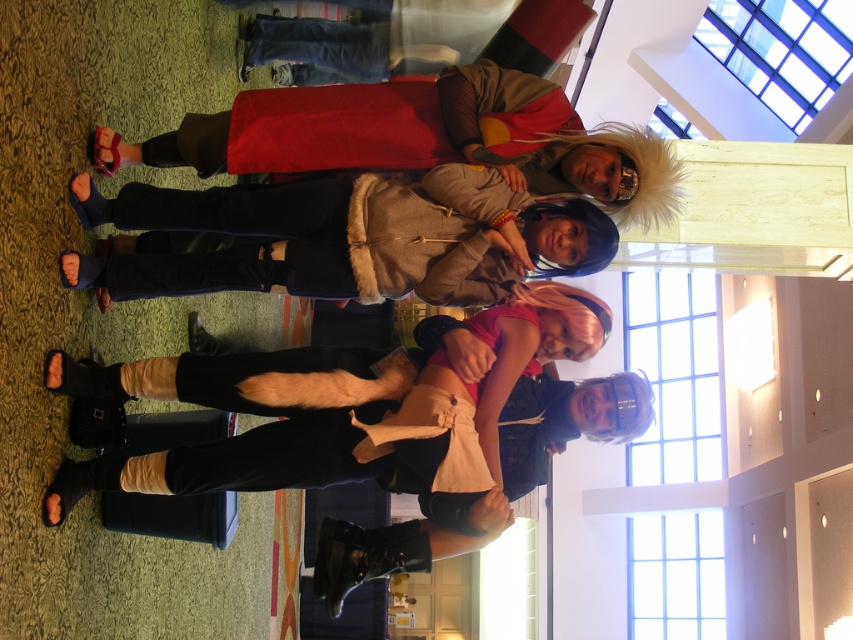
You are a photographer at the event and want to take a photo that includes both the point at (579, 188) and the point at (570, 241). Which point should you focus on first to ensure both are in sharp focus?

You should focus on point (579, 188) first because it is closer to the viewer than point (570, 241). This ensures that both points will be in focus as the camera adjusts depth of field.